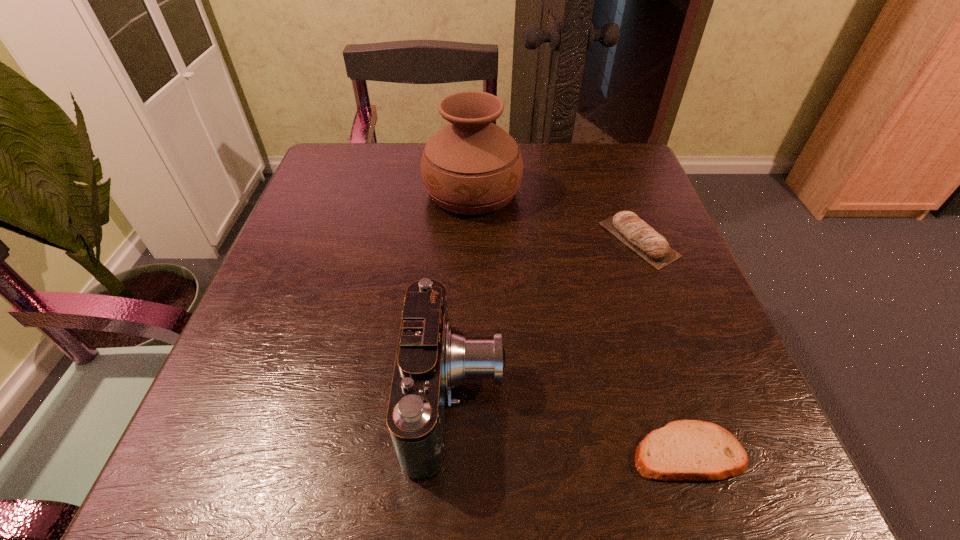
At what (x,y) coordinates should I click in order to perform the action: click on vacant region between the third shortest object and the taller pita bread. Please return your answer as a coordinate pair (x, y). Looking at the image, I should click on (547, 318).

Identify the location of object identified as the closest to the urn. This screenshot has width=960, height=540. (645, 241).

Where is `object that is the second closest to the camcorder`? The width and height of the screenshot is (960, 540). object that is the second closest to the camcorder is located at coordinates point(645,241).

This screenshot has height=540, width=960. I want to click on vacant space that satisfies the following two spatial constraints: 1. on the front side of the urn; 2. on the right side of the shorter pita bread, so click(467, 452).

You are a GUI agent. You are given a task and a screenshot of the screen. Output one action in this format:
    pyautogui.click(x=<x>, y=<y>)
    Task: Click on the vacant space that satisfies the following two spatial constraints: 1. on the front-facing side of the camcorder; 2. on the left side of the shortest object
    
    Given the screenshot: What is the action you would take?
    pyautogui.click(x=454, y=452)

I want to click on vacant space that satisfies the following two spatial constraints: 1. on the back side of the shorter pita bread; 2. on the front-facing side of the camcorder, so (669, 396).

Where is `vacant position in the image that satisfies the following two spatial constraints: 1. on the front-facing side of the shorter pita bread; 2. on the left side of the camcorder`? The width and height of the screenshot is (960, 540). vacant position in the image that satisfies the following two spatial constraints: 1. on the front-facing side of the shorter pita bread; 2. on the left side of the camcorder is located at coordinates (454, 452).

This screenshot has height=540, width=960. I want to click on blank space that satisfies the following two spatial constraints: 1. on the front-facing side of the camcorder; 2. on the left side of the shorter pita bread, so click(x=454, y=452).

Where is `blank area in the image that satisfies the following two spatial constraints: 1. on the back side of the farther pita bread; 2. on the right side of the shorter pita bread`? Image resolution: width=960 pixels, height=540 pixels. blank area in the image that satisfies the following two spatial constraints: 1. on the back side of the farther pita bread; 2. on the right side of the shorter pita bread is located at coordinates (618, 240).

The height and width of the screenshot is (540, 960). Find the location of `free space that satisfies the following two spatial constraints: 1. on the front side of the shortest object; 2. on the left side of the tallest object`. free space that satisfies the following two spatial constraints: 1. on the front side of the shortest object; 2. on the left side of the tallest object is located at coordinates (467, 452).